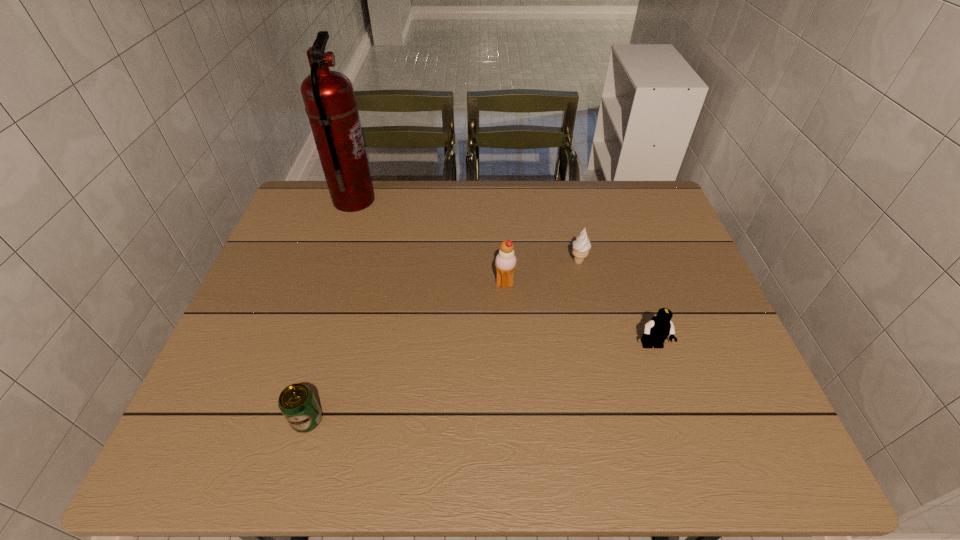
Identify the location of object that is at the right edge. (656, 331).

Find the location of a particular element. object at the far left corner is located at coordinates (328, 96).

At what (x,y) coordinates should I click in order to perform the action: click on free space at the far edge. Please return your answer as a coordinate pair (x, y). Looking at the image, I should click on (584, 210).

Where is `free space at the near edge of the desktop`? Image resolution: width=960 pixels, height=540 pixels. free space at the near edge of the desktop is located at coordinates (655, 460).

I want to click on free region at the left edge of the desktop, so click(245, 373).

In the image, there is a desktop. Where is `vacant space at the right edge`? vacant space at the right edge is located at coordinates (683, 327).

At what (x,y) coordinates should I click in order to perform the action: click on vacant space at the far left corner of the desktop. Please return your answer as a coordinate pair (x, y). Looking at the image, I should click on (318, 191).

In order to click on free spot between the rightmost object and the nearest object in this screenshot , I will do `click(480, 383)`.

Where is `free space that is in between the second nearest object and the second tallest object`? The image size is (960, 540). free space that is in between the second nearest object and the second tallest object is located at coordinates (578, 315).

The image size is (960, 540). I want to click on empty space that is in between the fire extinguisher and the second object from right to left, so click(467, 231).